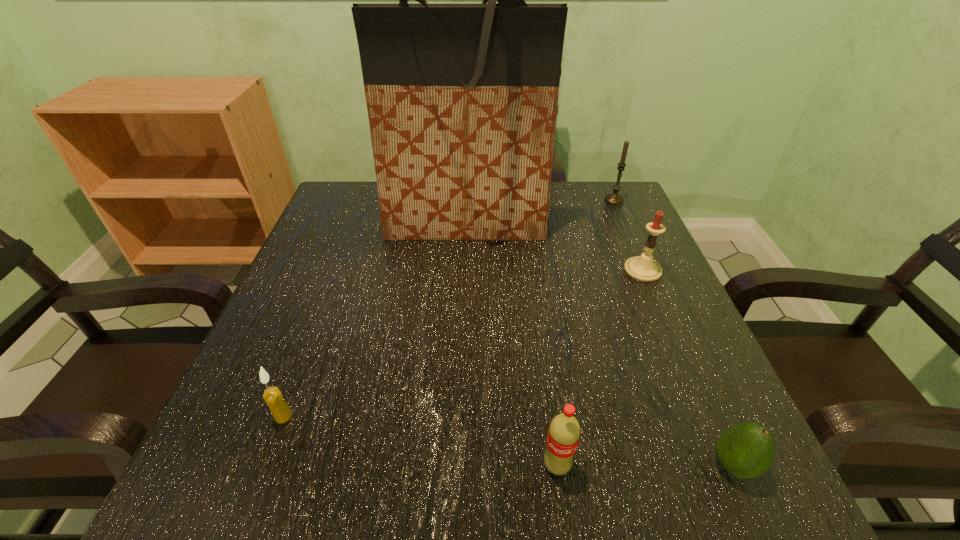
Locate an element on the screen. object that is at the near right corner is located at coordinates (746, 450).

Image resolution: width=960 pixels, height=540 pixels. In the image, there is a desktop. In order to click on vacant space at the near edge in this screenshot , I will do `click(539, 461)`.

In the image, there is a desktop. Identify the location of vacant space at the left edge. The image size is (960, 540). (304, 293).

Identify the location of vacant space at the right edge of the desktop. (665, 298).

In order to click on free region at the far left corner of the desktop in this screenshot , I will do `click(333, 211)`.

Identify the location of free space at the far right corner of the desktop. The height and width of the screenshot is (540, 960). (601, 201).

Locate an element on the screen. The image size is (960, 540). free space between the soda and the shopping bag is located at coordinates (511, 346).

Locate an element on the screen. The width and height of the screenshot is (960, 540). free space between the shopping bag and the shortest object is located at coordinates (599, 346).

Image resolution: width=960 pixels, height=540 pixels. In order to click on free point between the leftmost object and the shopping bag in this screenshot , I will do `click(374, 321)`.

Identify the location of free space between the farthest candle and the fourth nearest object. The image size is (960, 540). (629, 235).